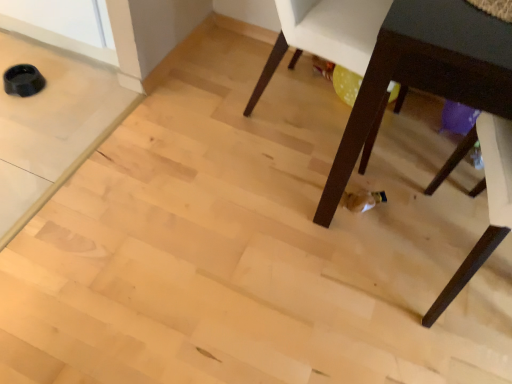
Image resolution: width=512 pixels, height=384 pixels. I want to click on vacant space underneath dark wood table at lower right (from a real-world perspective), so click(412, 163).